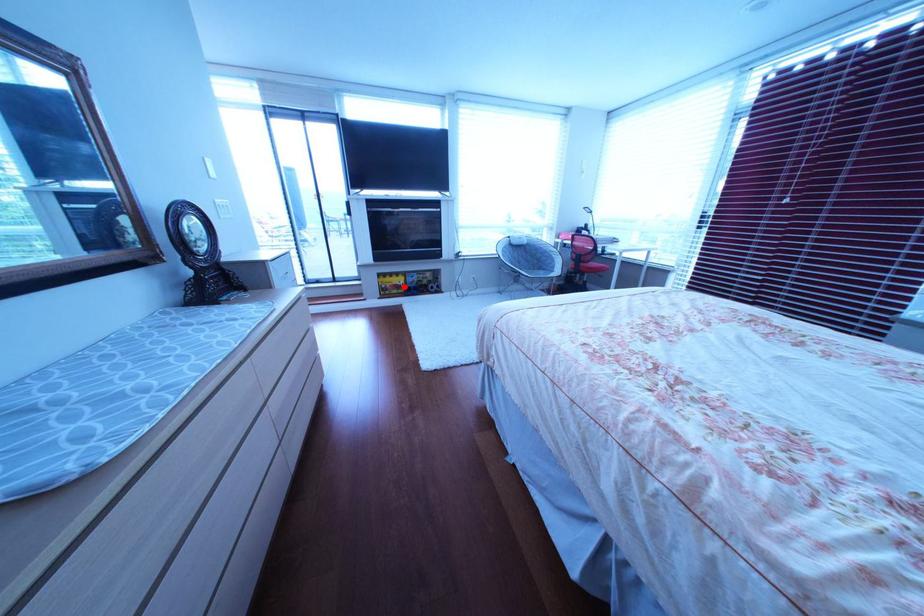
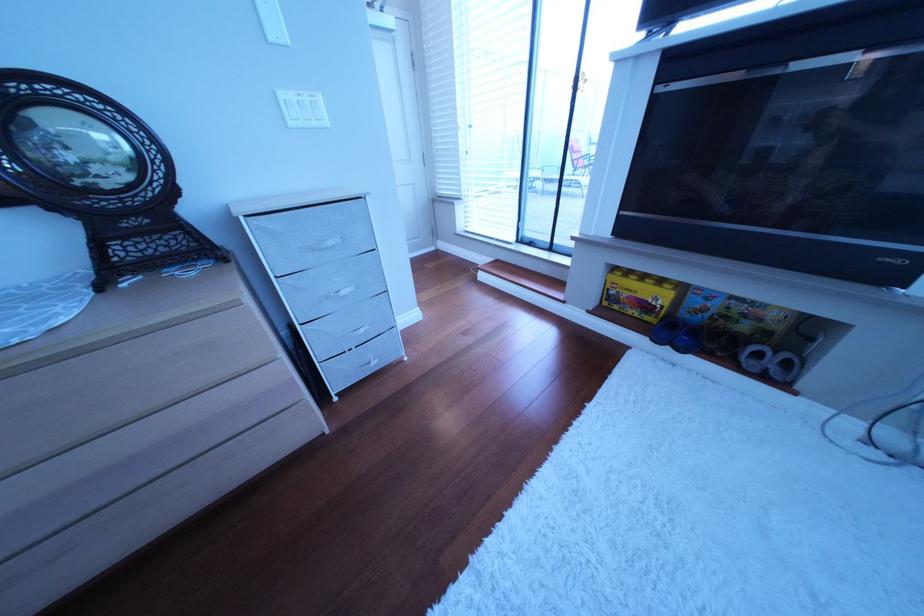
The point at the highlighted location is marked in the first image. Where is the corresponding point in the second image?

(640, 296)